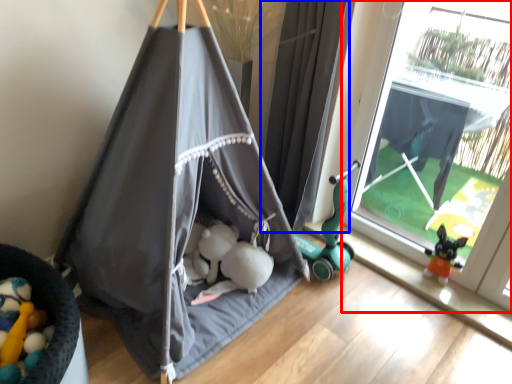
Question: Which point is further to the camera, window (highlighted by a red box) or curtain (highlighted by a blue box)?

Choices:
 (A) window
 (B) curtain

Answer: (B)